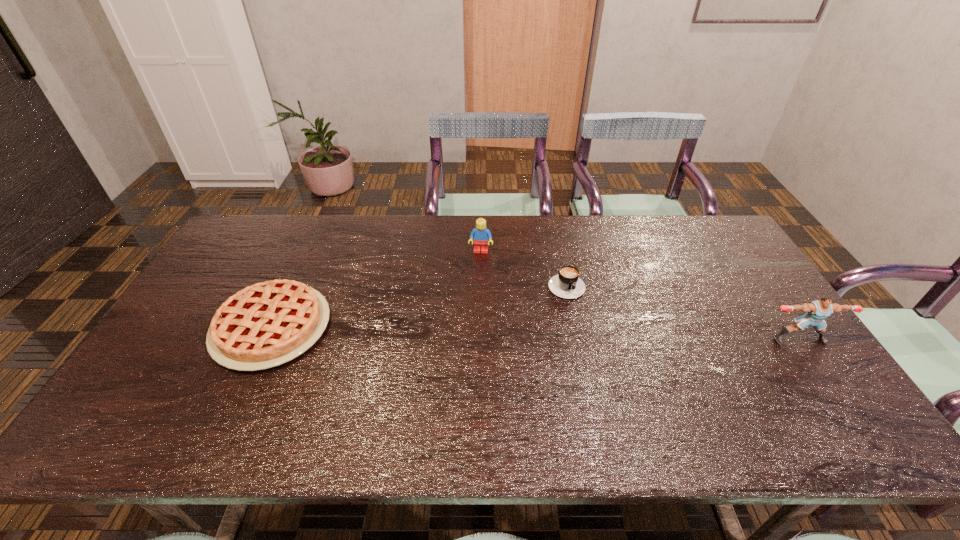
Find the location of a particular element. empty space between the third shortest object and the tallest object is located at coordinates (640, 295).

You are a GUI agent. You are given a task and a screenshot of the screen. Output one action in this format:
    pyautogui.click(x=<x>, y=<y>)
    Task: Click on the free space between the second object from left to right and the leftmost object
    
    Given the screenshot: What is the action you would take?
    [x=376, y=289]

Find the location of a particular element. The image size is (960, 540). the second closest object to the pie is located at coordinates (567, 284).

Where is `the closest object relative to the pie`? the closest object relative to the pie is located at coordinates (480, 234).

Identify the location of vacant space that satisfies the following two spatial constraints: 1. on the back side of the leftmost object; 2. on the left side of the cappuccino. coord(293,282).

This screenshot has width=960, height=540. I want to click on free spot that satisfies the following two spatial constraints: 1. on the front side of the second object from right to left; 2. on the right side of the third object from right to left, so click(x=481, y=282).

Find the location of a particular element. The width and height of the screenshot is (960, 540). free space that satisfies the following two spatial constraints: 1. on the front side of the cappuccino; 2. on the right side of the Lego is located at coordinates (481, 282).

This screenshot has height=540, width=960. Identify the location of free location that satisfies the following two spatial constraints: 1. on the back side of the pie; 2. on the left side of the cappuccino. (293, 282).